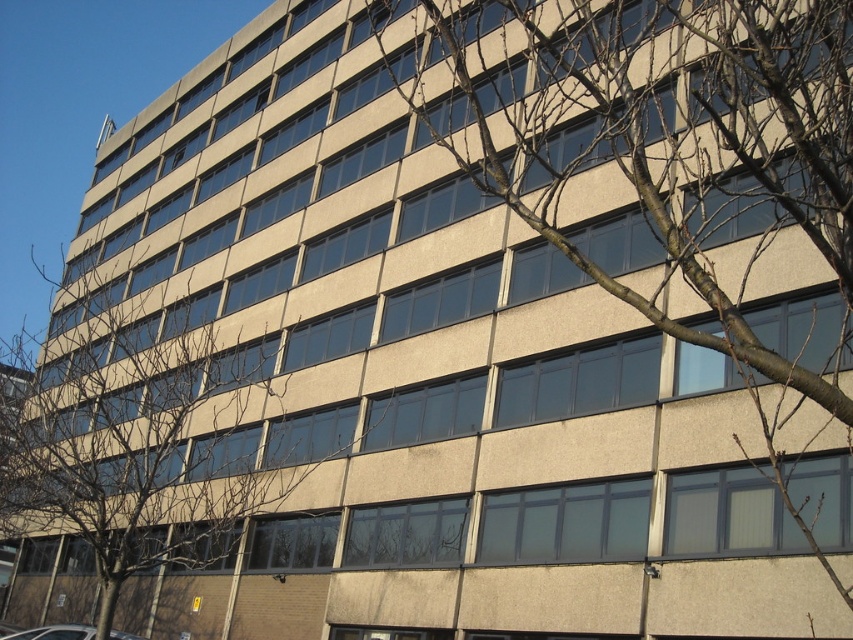
Question: Which point is farther from the camera taking this photo?

Choices:
 (A) (85, 628)
 (B) (67, 500)
 (C) (473, 20)

Answer: (C)

Question: Estimate the real-world distances between objects in this image. Which object is farther from the gray concrete building at center?

Choices:
 (A) bare branches at center
 (B) white glossy car at lower left

Answer: (B)

Question: Which point is closer to the camera?

Choices:
 (A) white glossy car at lower left
 (B) gray concrete building at center
 (C) bare branches at center

Answer: (B)

Question: Does gray concrete building at center have a lesser width compared to bare branches at center?

Choices:
 (A) yes
 (B) no

Answer: (A)

Question: Is the position of gray concrete building at center less distant than that of bare branches at center?

Choices:
 (A) yes
 (B) no

Answer: (A)

Question: Is gray concrete building at center to the left of bare branches at center from the viewer's perspective?

Choices:
 (A) yes
 (B) no

Answer: (B)